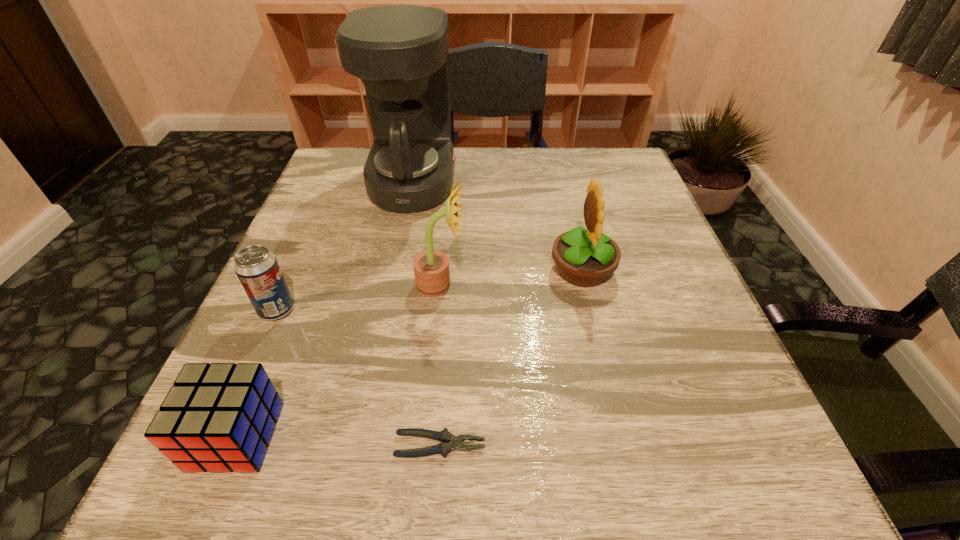
Image resolution: width=960 pixels, height=540 pixels. I want to click on vacant space situated 0.180m on the face of the rightmost object, so click(458, 270).

Identify the location of vacant space located 0.300m on the face of the rightmost object. The width and height of the screenshot is (960, 540). (396, 270).

Locate an element on the screen. The image size is (960, 540). free region located 0.360m on the back of the beer can is located at coordinates (330, 188).

Identify the location of vacant space located on the right of the fifth tallest object. (324, 436).

Locate an element on the screen. The height and width of the screenshot is (540, 960). vacant space situated at the gripping part of the shortest object is located at coordinates (550, 445).

Where is `object situated at the far edge`? The image size is (960, 540). object situated at the far edge is located at coordinates (400, 52).

Find the location of a particular element. The height and width of the screenshot is (540, 960). cube present at the near edge is located at coordinates (220, 417).

In order to click on pliers located in the near edge section of the desktop in this screenshot , I will do `click(445, 437)`.

Identify the location of coffee maker present at the left edge. The height and width of the screenshot is (540, 960). (400, 52).

I want to click on beer can present at the left edge, so click(x=257, y=268).